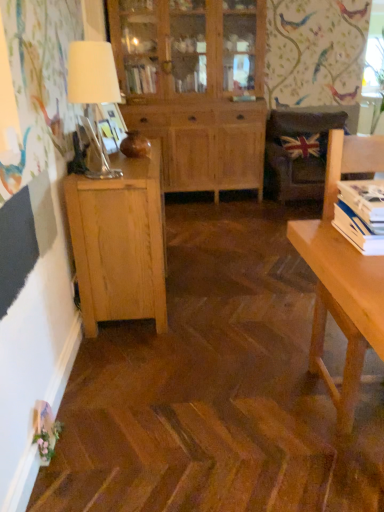
Where is `vacant point above union jack fabric pillow at upper right (from a real-world perspective)`? This screenshot has height=512, width=384. vacant point above union jack fabric pillow at upper right (from a real-world perspective) is located at coordinates (301, 135).